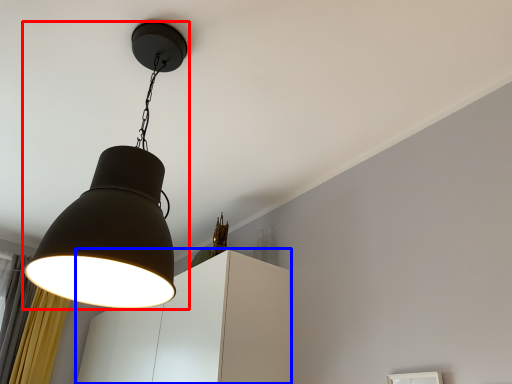
Question: Which point is further to the camera, lamp (highlighted by a red box) or cabinetry (highlighted by a blue box)?

Choices:
 (A) lamp
 (B) cabinetry

Answer: (B)